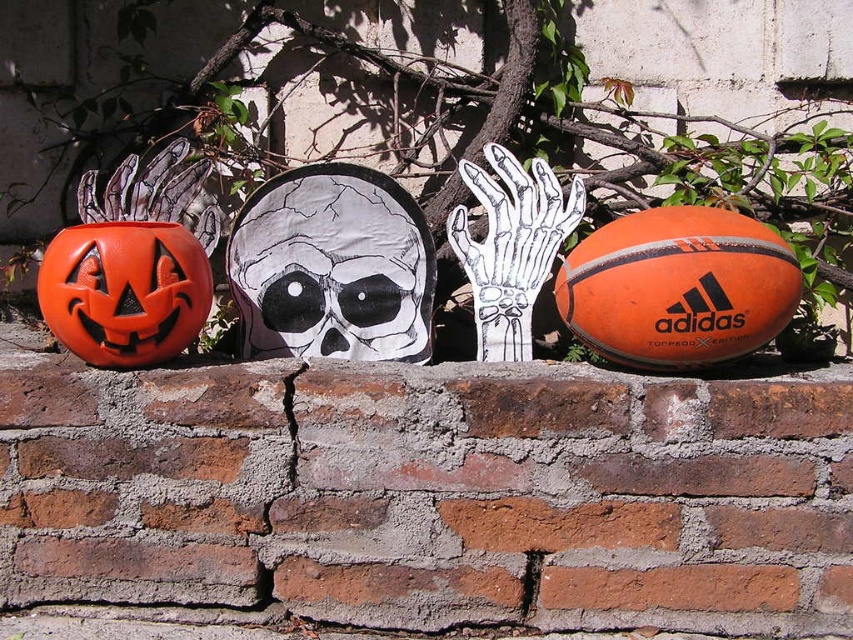
Is the position of black paper skull at center less distant than that of orange rubber basketball at right?

No.

Between black paper skull at center and orange rubber basketball at right, which one appears on the right side from the viewer's perspective?

Positioned to the right is orange rubber basketball at right.

Is point (335, 204) positioned after point (743, 339)?

Yes, it is behind point (743, 339).

Find the location of `black paper skull at center`. black paper skull at center is located at coordinates (332, 268).

Between orange rubber basketball at right and orange matte pumpkin at left, which one has less height?

Standing shorter between the two is orange rubber basketball at right.

Which is more to the left, orange rubber basketball at right or orange matte pumpkin at left?

orange matte pumpkin at left is more to the left.

Find the location of a particular element. This screenshot has height=640, width=853. orange rubber basketball at right is located at coordinates (x=677, y=288).

Does black paper skull at center appear over orange matte pumpkin at left?

No, black paper skull at center is not above orange matte pumpkin at left.

The image size is (853, 640). In order to click on black paper skull at center in this screenshot , I will do point(332,268).